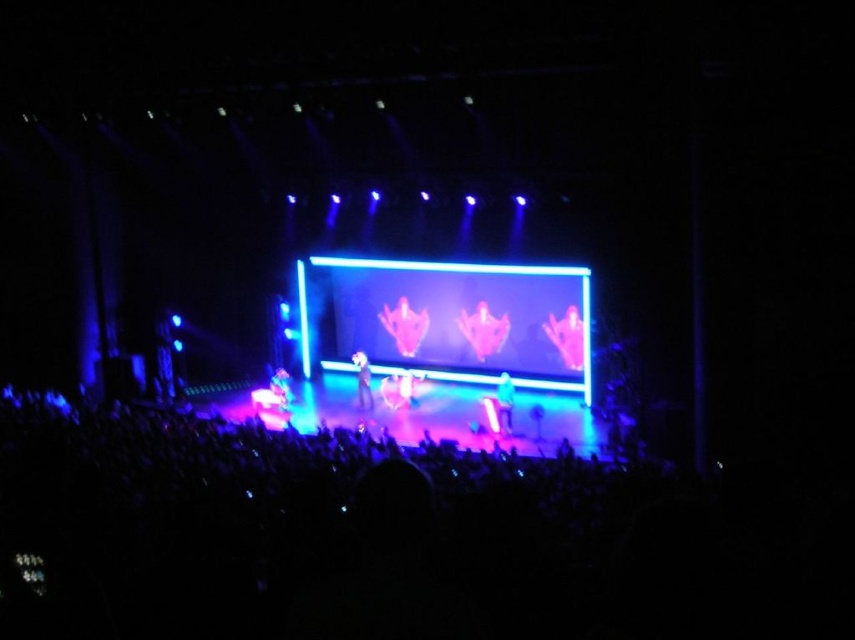
Question: Among these objects, which one is farthest from the camera?

Choices:
 (A) pink fabric person at center
 (B) shiny blue jacket at center
 (C) neon pink fabric at center
 (D) shiny silver microphone at center

Answer: (A)

Question: Does pink neon screen at center appear under translucent pink figure at center?

Choices:
 (A) yes
 (B) no

Answer: (A)

Question: Is pink neon screen at center below pink matte hand at center?

Choices:
 (A) no
 (B) yes

Answer: (A)

Question: Which point is farther from the camera taking this photo?

Choices:
 (A) (506, 422)
 (B) (487, 349)
 (C) (559, 346)

Answer: (B)

Question: Is shiny blue jacket at center thinner than shiny silver microphone at center?

Choices:
 (A) no
 (B) yes

Answer: (B)

Question: Which point is closer to the camera?

Choices:
 (A) translucent pink figure at center
 (B) neon pink fabric at center

Answer: (B)